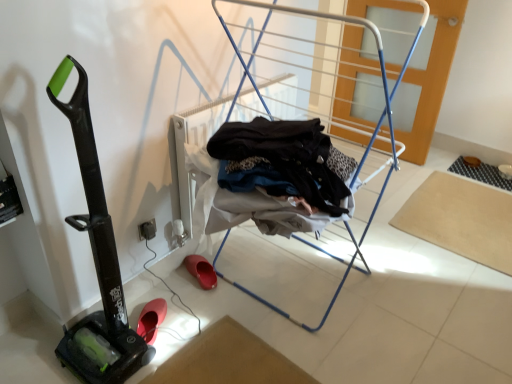
This screenshot has width=512, height=384. I want to click on vacant space that's between black rubber vacuum at left and rubber/soft sole shoe at lower left, marked as the 1th footwear in a front-to-back arrangement, so click(146, 319).